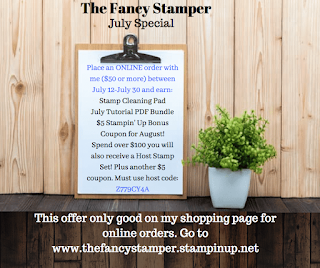
The image size is (320, 268). Find the location of `wall`. wall is located at coordinates (61, 59), (215, 55).